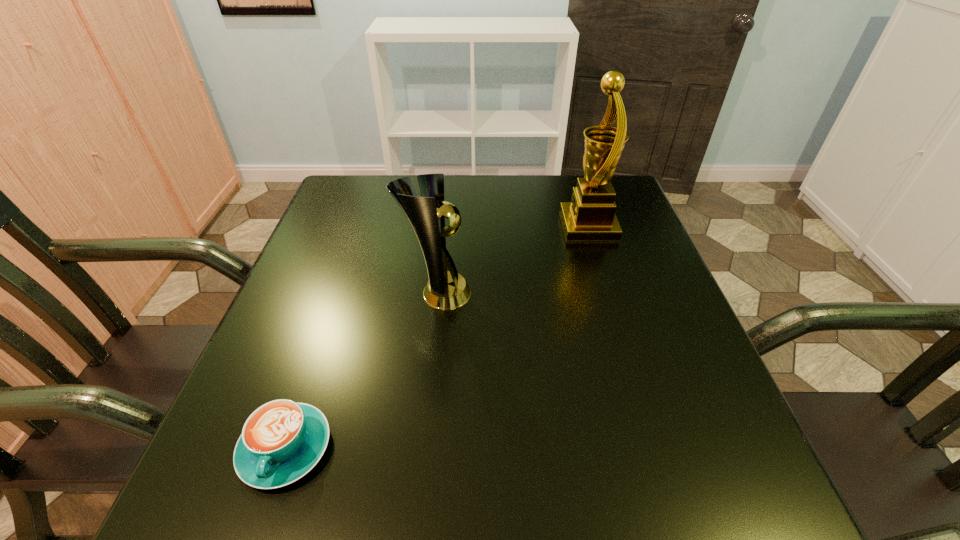
The height and width of the screenshot is (540, 960). I want to click on the rightmost object, so click(590, 216).

This screenshot has height=540, width=960. I want to click on the right award, so click(590, 216).

Where is `the nearer award`? This screenshot has height=540, width=960. the nearer award is located at coordinates (446, 290).

At what (x,y) coordinates should I click in order to perform the action: click on the second tallest object. Please return your answer as a coordinate pair (x, y). This screenshot has height=540, width=960. Looking at the image, I should click on (446, 290).

What are the coordinates of `the nearest object` in the screenshot? It's located at (281, 441).

At what (x,y) coordinates should I click in order to perform the action: click on the leftmost object. Please return your answer as a coordinate pair (x, y). This screenshot has width=960, height=540. Looking at the image, I should click on (281, 441).

Image resolution: width=960 pixels, height=540 pixels. I want to click on vacant area situated 0.230m on the front-facing side of the taller award, so click(470, 226).

At what (x,y) coordinates should I click in order to perform the action: click on blank area located 0.180m on the front-facing side of the taller award. Please return your answer as a coordinate pair (x, y). The height and width of the screenshot is (540, 960). Looking at the image, I should click on (491, 226).

The height and width of the screenshot is (540, 960). Identify the location of vacant space located 0.090m on the front-facing side of the taller award. (526, 226).

Image resolution: width=960 pixels, height=540 pixels. Find the location of `vacant space located 0.070m at the front of the second farthest object, where the globe is visible`. vacant space located 0.070m at the front of the second farthest object, where the globe is visible is located at coordinates (505, 293).